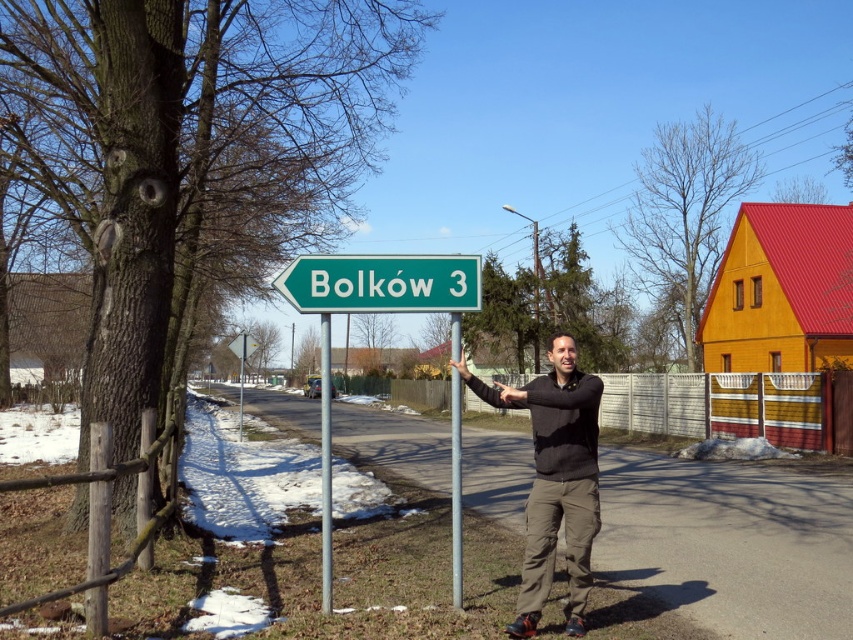
Question: Does black matte sweater at center appear under green metallic pole at center?

Choices:
 (A) yes
 (B) no

Answer: (B)

Question: Which of the following is the closest to the observer?

Choices:
 (A) black matte sweater at center
 (B) metallic pole at center

Answer: (A)

Question: Which point appears farthest from the camera in this image?

Choices:
 (A) (556, 480)
 (B) (456, 522)
 (C) (306, 310)
 (D) (328, 467)

Answer: (B)

Question: Which of the following is the farthest from the observer?

Choices:
 (A) (326, 404)
 (B) (454, 365)

Answer: (A)

Question: In this image, where is green plastic sign at center located relative to metallic pole at center?

Choices:
 (A) left
 (B) right

Answer: (B)

Question: Does green plastic sign at center appear over metallic pole at center?

Choices:
 (A) yes
 (B) no

Answer: (A)